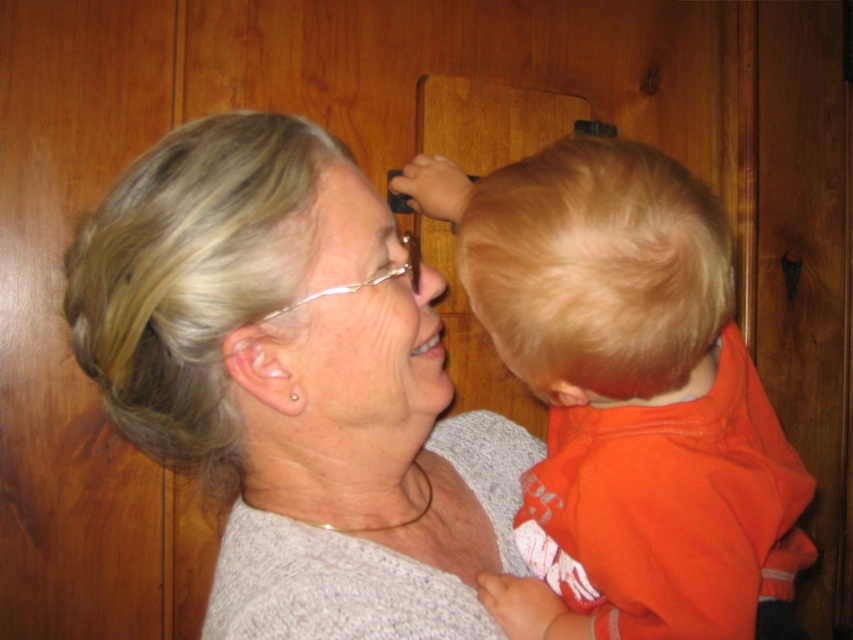
Question: Considering the relative positions of orange cotton shirt at right and matte skin forehead at upper center in the image provided, where is orange cotton shirt at right located with respect to matte skin forehead at upper center?

Choices:
 (A) above
 (B) below

Answer: (B)

Question: Which point is farther to the camera?

Choices:
 (A) (379, 266)
 (B) (467, 529)
 (C) (553, 522)

Answer: (B)

Question: Can you confirm if orange cotton shirt at right is bigger than matte skin forehead at upper center?

Choices:
 (A) no
 (B) yes

Answer: (B)

Question: Which object is the farthest from the matte skin forehead at upper center?

Choices:
 (A) orange cotton shirt at right
 (B) gray knit sweater at upper left

Answer: (A)

Question: Considering the real-world distances, which object is farthest from the orange cotton shirt at right?

Choices:
 (A) matte skin forehead at upper center
 (B) gray knit sweater at upper left

Answer: (A)

Question: Does gray knit sweater at upper left appear on the right side of matte skin forehead at upper center?

Choices:
 (A) yes
 (B) no

Answer: (B)